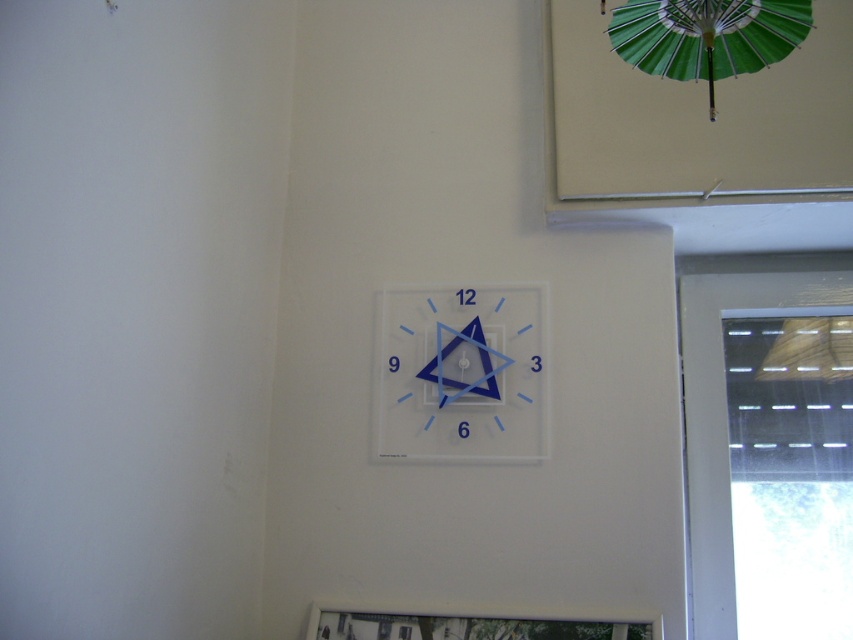
Between point (421, 291) and point (729, 58), which one is positioned behind?

Positioned behind is point (421, 291).

How far apart are transparent plastic clock at center and green paper umbrella at upper right?

transparent plastic clock at center and green paper umbrella at upper right are 23.09 inches apart.

Which is in front, point (465, 456) or point (648, 68)?

Positioned in front is point (648, 68).

Identify the location of transparent plastic clock at center. This screenshot has width=853, height=640. (463, 372).